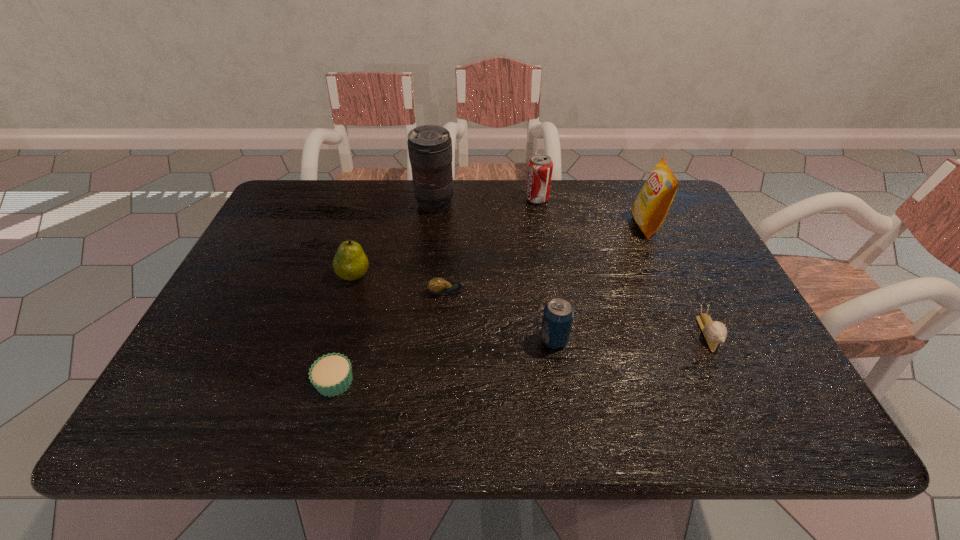
Where is `crisp (potato chip) present at the far edge`? This screenshot has width=960, height=540. crisp (potato chip) present at the far edge is located at coordinates (651, 206).

This screenshot has width=960, height=540. I want to click on soda can that is at the far edge, so click(x=540, y=167).

The width and height of the screenshot is (960, 540). In order to click on object that is positioned at the near edge in this screenshot , I will do `click(331, 374)`.

What are the coordinates of `crisp (potato chip) that is positioned at the right edge` in the screenshot? It's located at (651, 206).

Identify the location of escargot that is at the right edge. The width and height of the screenshot is (960, 540). (714, 332).

Where is `object located at the far right corner`? This screenshot has height=540, width=960. object located at the far right corner is located at coordinates (651, 206).

You are a GUI agent. You are given a task and a screenshot of the screen. Output one action in this format:
    pyautogui.click(x=<x>, y=<y>)
    Task: Click on the vacant space at the far edge of the desktop
    
    Given the screenshot: What is the action you would take?
    pyautogui.click(x=547, y=217)

Identify the location of vacant space at the near edge of the desktop. (520, 429).

Identify the location of free point at the left edge. Image resolution: width=960 pixels, height=540 pixels. (300, 267).

This screenshot has height=540, width=960. Identify the location of vacant region at the right edge of the desktop. (717, 315).